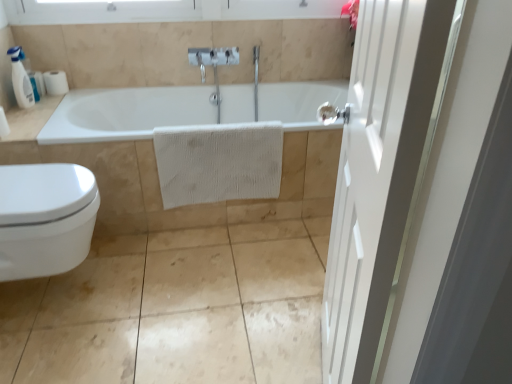
The width and height of the screenshot is (512, 384). Identify the location of vacant space underneath white glossy counter top at upper left (from a real-world perspective). (32, 116).